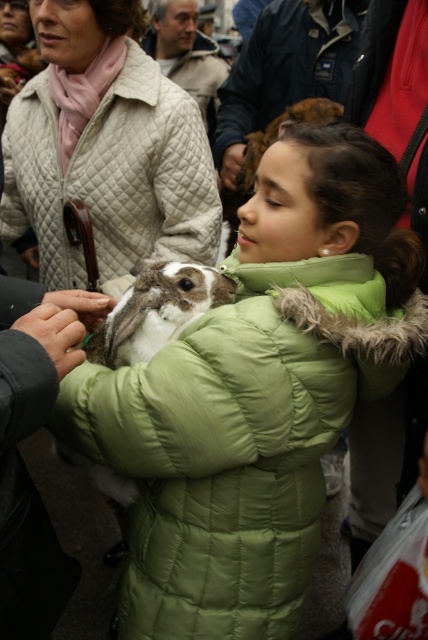
You are a photographer at the event and want to capture a group photo of the girl in the green quilted coat at center and the person with white matte skin at center. Given their sizes, will you need to adjust your camera angle to ensure both are fully visible in the frame?

The green quilted coat at center is wider than the white matte skin at center, so you should position the camera slightly closer to the green quilted coat at center to ensure both are fully visible in the frame.

You are a photographer at the event and want to capture a photo of the brown fur rabbit at center without the dark gray fabric hand at lower left blocking it. Based on their sizes, can you position the camera so the rabbit is fully visible above the hand?

The brown fur rabbit at center is taller than the dark gray fabric hand at lower left, so positioning the camera to focus on the rabbit above the hand should allow it to be fully visible without obstruction.